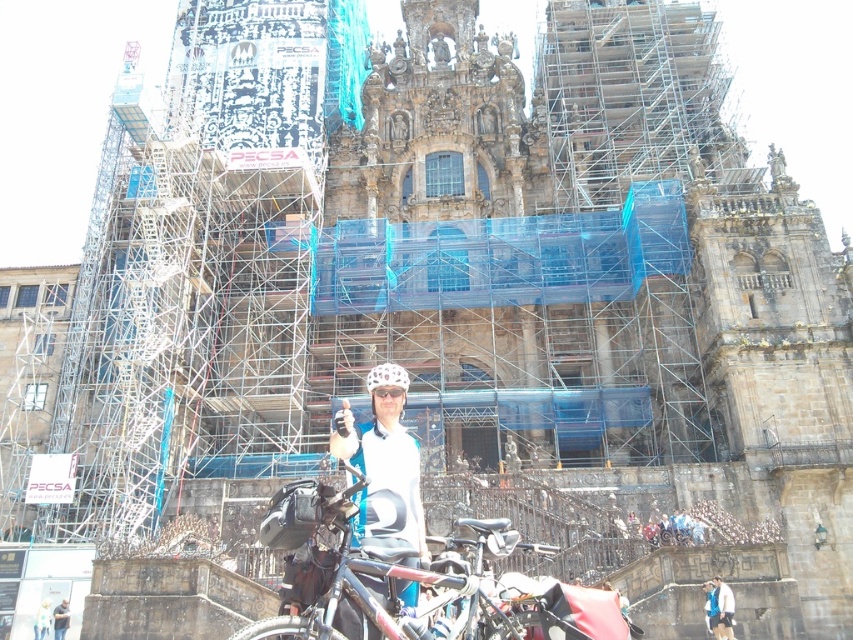
Question: Which of the following is the farthest from the observer?

Choices:
 (A) white matte bicycle helmet at center
 (B) white helmet at center
 (C) shiny black bicycle at center
 (D) dark gray helmet at center

Answer: (B)

Question: Is white matte helmet at center smaller than white matte bicycle helmet at center?

Choices:
 (A) yes
 (B) no

Answer: (B)

Question: Can you confirm if white matte helmet at center is positioned below white fabric jacket at lower right?

Choices:
 (A) no
 (B) yes

Answer: (A)

Question: Does dark gray helmet at center lie in front of white helmet at center?

Choices:
 (A) no
 (B) yes

Answer: (B)

Question: Which object is the closest to the dark gray helmet at center?

Choices:
 (A) white fabric jacket at lower right
 (B) shiny black bicycle at center
 (C) white matte helmet at center

Answer: (C)

Question: Which of these objects is positioned farthest from the shiny black bicycle at center?

Choices:
 (A) white matte helmet at center
 (B) white matte bicycle helmet at center
 (C) white helmet at center

Answer: (C)